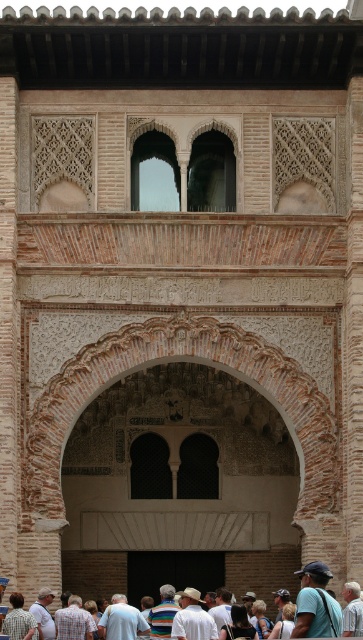
Question: Which of the following is the closest to the observer?

Choices:
 (A) white cotton shirt at center
 (B) light blue shirt at lower left

Answer: (A)

Question: Which point is farther to the camera?

Choices:
 (A) white cotton shirt at center
 (B) light blue shirt at lower left

Answer: (B)

Question: Does light blue shirt at lower left appear under white cotton shirt at lower center?

Choices:
 (A) no
 (B) yes

Answer: (A)

Question: Can you confirm if white cotton shirt at center is wider than white cotton shirt at lower center?

Choices:
 (A) no
 (B) yes

Answer: (B)

Question: Which of the following is the closest to the observer?

Choices:
 (A) (242, 632)
 (B) (6, 612)

Answer: (A)

Question: Considering the relative positions of light blue shirt at lower left and white cotton shirt at lower center in the image provided, where is light blue shirt at lower left located with respect to white cotton shirt at lower center?

Choices:
 (A) right
 (B) left

Answer: (B)